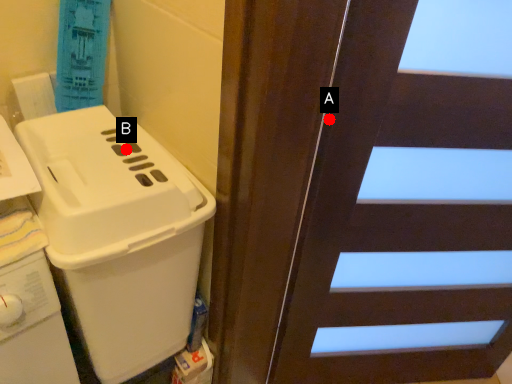
Question: Two points are circled on the image, labeled by A and B beside each circle. Which point appears closest to the camera in this image?

Choices:
 (A) A is closer
 (B) B is closer

Answer: (A)